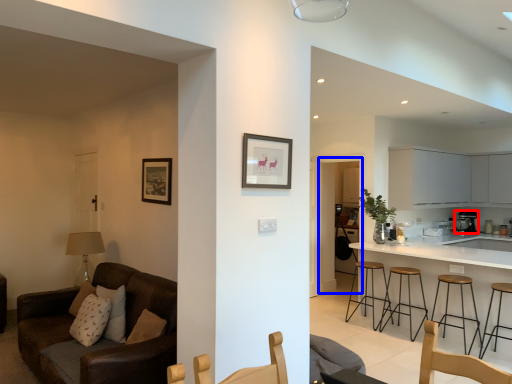
Question: Which of the following is the closest to the observer, appliance (highlighted by a red box) or glass door (highlighted by a blue box)?

Choices:
 (A) appliance
 (B) glass door

Answer: (B)